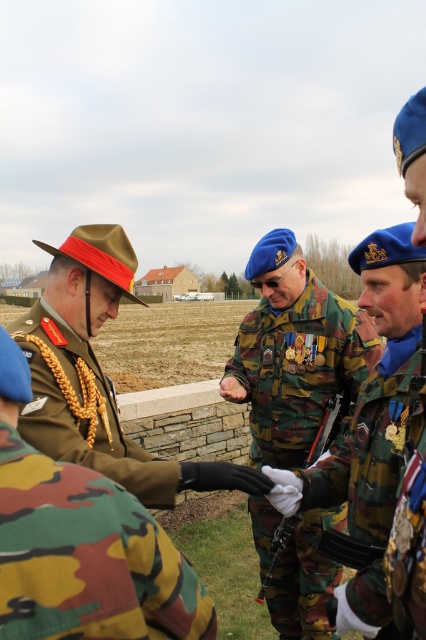
Is camo fabric uniform at center smaller than camouflage uniform at center?

Yes, camo fabric uniform at center is smaller than camouflage uniform at center.

Between camo fabric uniform at center and camouflage uniform at center, which one is positioned higher?

camouflage uniform at center is higher up.

The height and width of the screenshot is (640, 426). Find the location of `camo fabric uniform at center`. camo fabric uniform at center is located at coordinates (86, 557).

Who is more distant from viewer, (32, 499) or (29, 323)?

The point (29, 323) is more distant.

Is camo fabric uniform at center closer to camera compared to green camouflage uniform at center?

Yes, camo fabric uniform at center is in front of green camouflage uniform at center.

Is point (31, 524) more distant than point (36, 385)?

No, (31, 524) is closer to viewer.

Find the location of a particular element. camo fabric uniform at center is located at coordinates (86, 557).

Which is below, camouflage fabric uniform at center or camouflage uniform at center?

camouflage fabric uniform at center is below.

Does point (348, 371) come closer to viewer compared to point (28, 404)?

No.

Find the location of a particular element. This screenshot has height=640, width=426. camouflage fabric uniform at center is located at coordinates (298, 369).